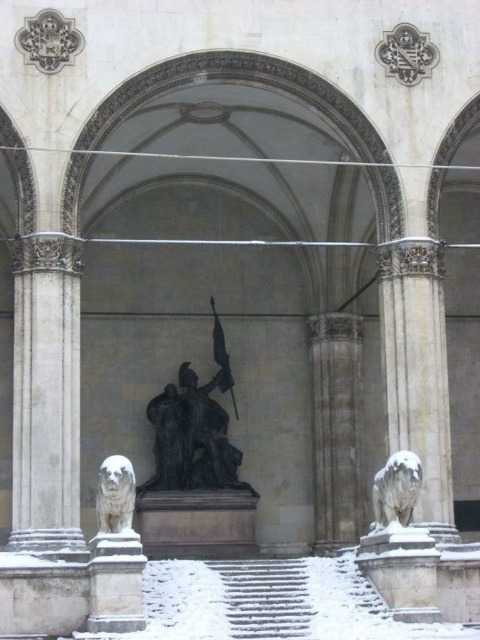
You are an architect visiting this historical site and need to determine the spatial relationship between the white stone stairs at center and the white marble lion at lower right. Which object is taller?

The white marble lion at lower right is taller than the white stone stairs at center.

You are a tour guide leading a group to the entrance of the building. You want to ensure that your group can hear you clearly while standing between the white marble column at left and the black polished statue at center. The sound system you have can project sound up to 20 meters. Will the sound system reach the entire group if they are positioned between these two objects?

The distance between the white marble column at left and the black polished statue at center is 18.20 meters, which is within the 20 meter range of the sound system. Therefore, the sound system will reach the entire group positioned between these two objects.

Based on the photo, you are standing in front of the grand entrance and want to take a photo of the white marble column at left. Where should you position yourself to capture the column at the coordinates point (46, 394)?

You should position yourself at point (46, 394) to capture the white marble column at left at the specified coordinates.